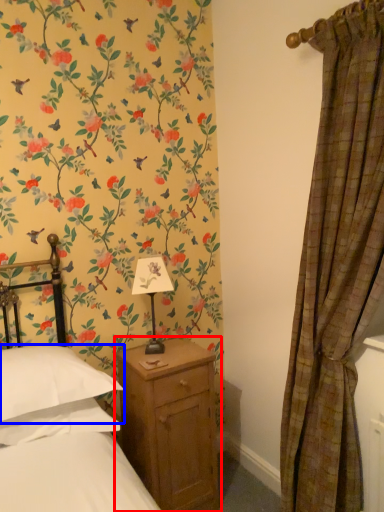
Question: Which point is closer to the camera, nightstand (highlighted by a red box) or pillow (highlighted by a blue box)?

Choices:
 (A) nightstand
 (B) pillow

Answer: (B)